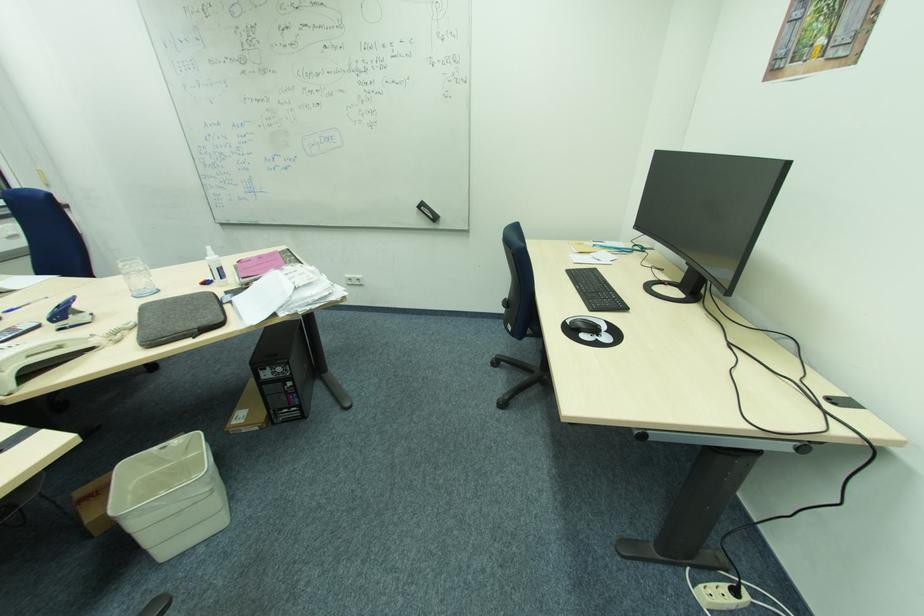
Where is `white telephone handset`? The image size is (924, 616). white telephone handset is located at coordinates (46, 349).